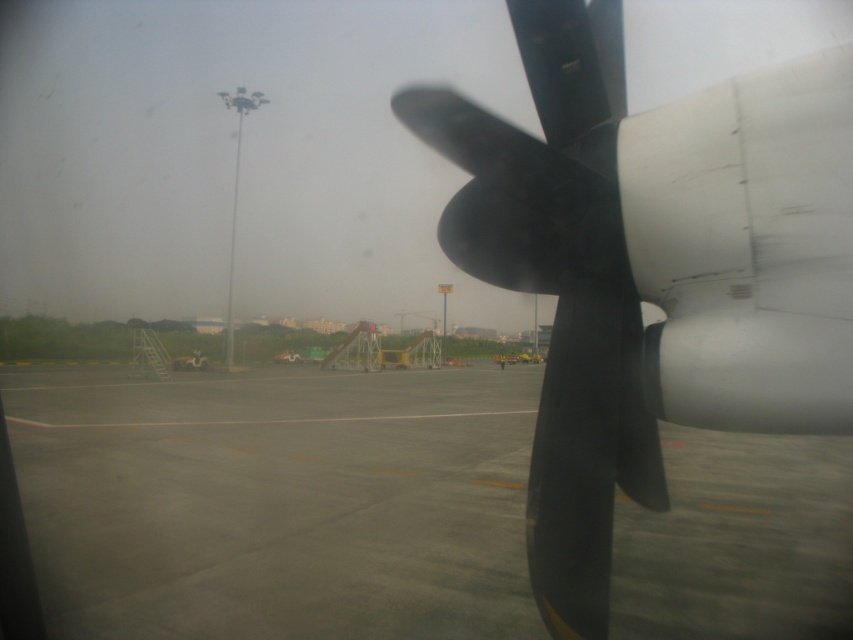
The image size is (853, 640). In order to click on gray concrete runway at center in this screenshot , I will do `click(276, 500)`.

Between gray concrete runway at center and matte black propeller at center, which one appears on the left side from the viewer's perspective?

From the viewer's perspective, gray concrete runway at center appears more on the left side.

Is point (135, 634) more distant than point (540, 499)?

That is True.

Locate an element on the screen. gray concrete runway at center is located at coordinates (276, 500).